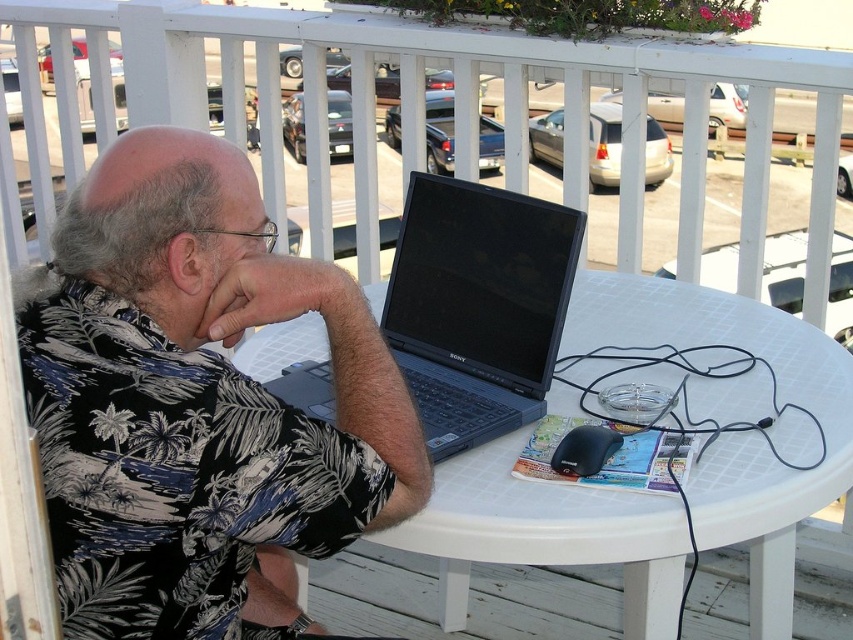
Is black floral shirt at center below white plastic table at center?

Incorrect, black floral shirt at center is not positioned below white plastic table at center.

Is point (328, 538) less distant than point (712, 531)?

That is True.

What do you see at coordinates (196, 403) in the screenshot? This screenshot has width=853, height=640. I see `black floral shirt at center` at bounding box center [196, 403].

Find the location of a particular element. This screenshot has height=640, width=853. black floral shirt at center is located at coordinates (196, 403).

Describe the element at coordinates (738, 433) in the screenshot. The height and width of the screenshot is (640, 853). I see `white plastic table at center` at that location.

Is point (396, 536) positioned before point (544, 337)?

Yes, point (396, 536) is closer to viewer.

You are a GUI agent. You are given a task and a screenshot of the screen. Output one action in this format:
    pyautogui.click(x=<x>, y=<y>)
    Task: Click on the white plastic table at center
    The image size is (853, 640).
    Given the screenshot: What is the action you would take?
    pyautogui.click(x=738, y=433)

Does black floral shirt at center appear on the left side of black plastic laptop at center?

Indeed, black floral shirt at center is positioned on the left side of black plastic laptop at center.

Who is more distant from viewer, (x=84, y=292) or (x=486, y=259)?

The point (x=486, y=259) is more distant.

Between point (233, 436) and point (537, 317), which one is positioned behind?

The point (537, 317) is more distant.

I want to click on black floral shirt at center, so click(x=196, y=403).